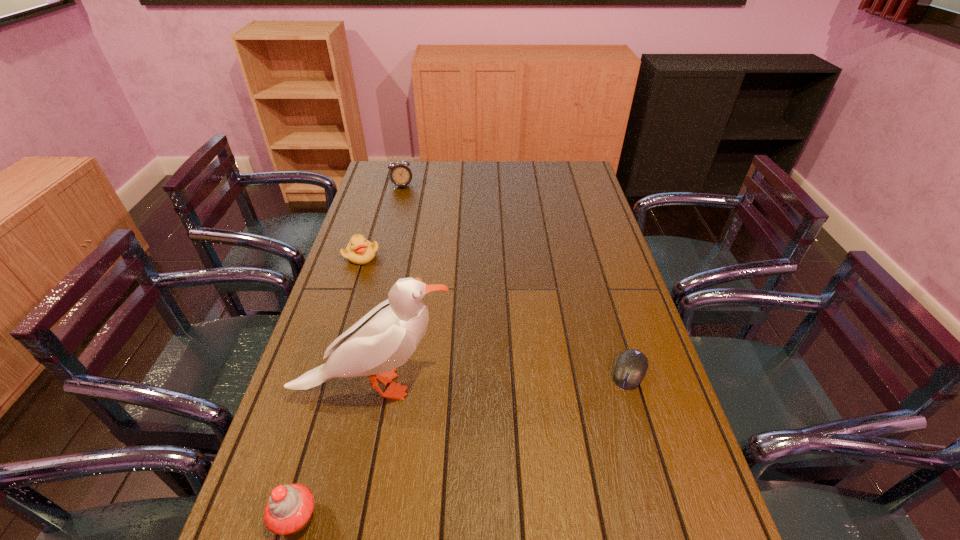
Where is `free area in between the alarm clock and the rightmost object`? free area in between the alarm clock and the rightmost object is located at coordinates 516,279.

Identify which object is the closest to the tallest object. Please provide its 2D coordinates. Your answer should be formatted as a tuple, i.e. [(x, y)], where the tuple contains the x and y coordinates of a point satisfying the conditions above.

[(288, 511)]

Locate which object ranks in proximity to the gull. Please provide its 2D coordinates. Your answer should be formatted as a tuple, i.e. [(x, y)], where the tuple contains the x and y coordinates of a point satisfying the conditions above.

[(288, 511)]